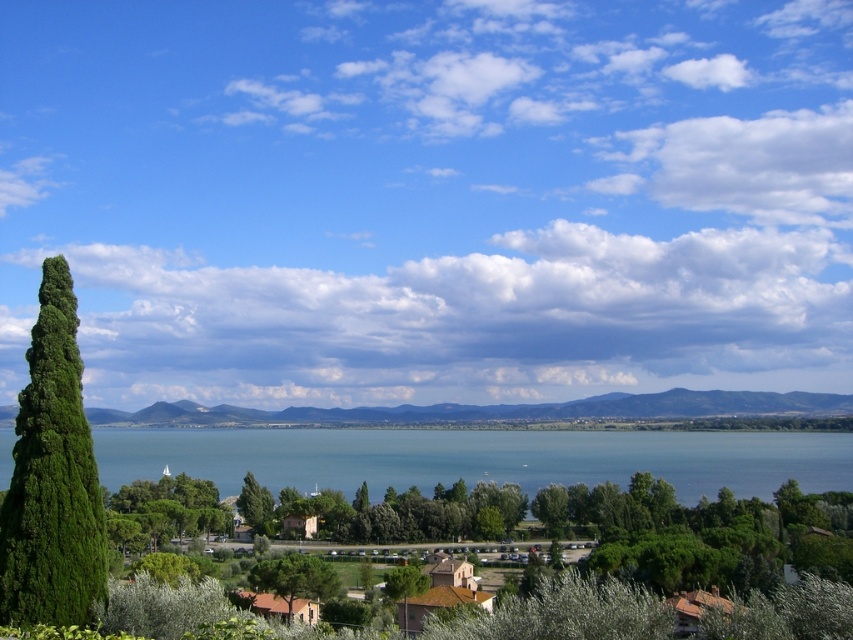
You are a photographer planning to capture the blue water at center and the green leafy cypress at left in a single shot. Based on their positions, which object should you frame first to ensure both are included in the photo?

The blue water at center is positioned on the left side of green leafy cypress at left, so you should frame the green leafy cypress at left first to ensure both are included in the photo.

You are standing at the edge of the lake and want to take a photo of the green leafy cypress at left and the blue water at center. Which object should you focus on first if you want both to be in sharp focus?

The green leafy cypress at left is closer to you than the blue water at center, so you should focus on the green leafy cypress at left first to ensure both are in sharp focus.